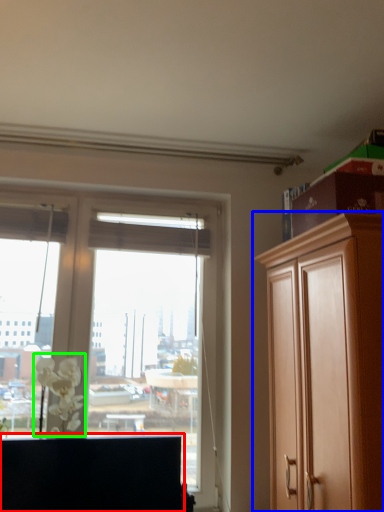
Question: Which object is the closest to the cabinetry (highlighted by a red box)? Choose among these: cabinetry (highlighted by a blue box) or flower (highlighted by a green box).

Choices:
 (A) cabinetry
 (B) flower

Answer: (B)